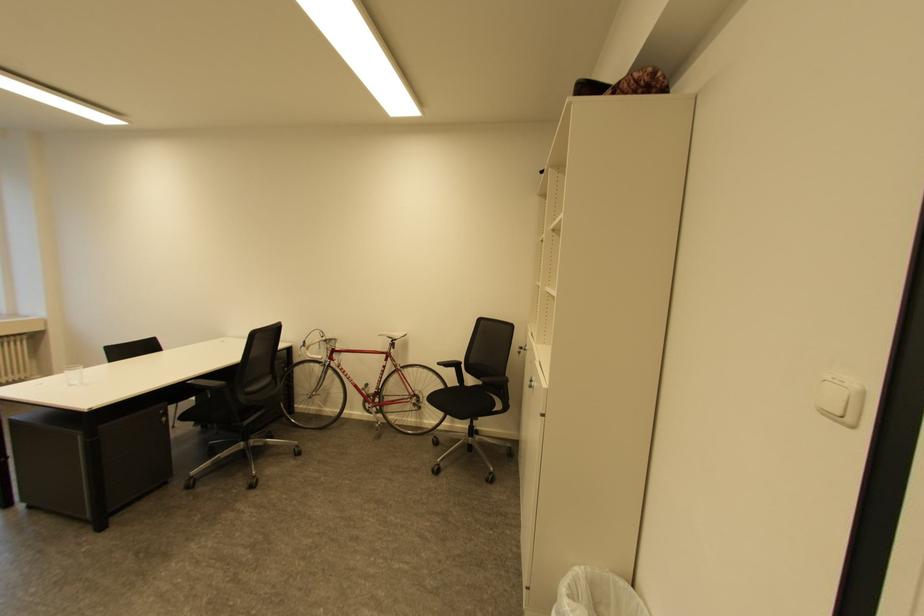
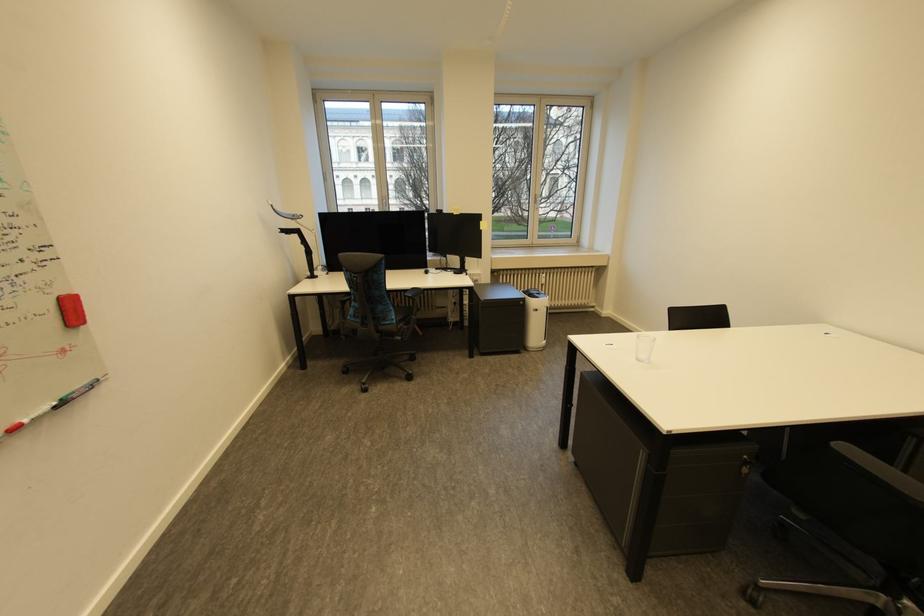
Where in the second image is the point corresponding to (191,492) from the first image?

(750, 604)